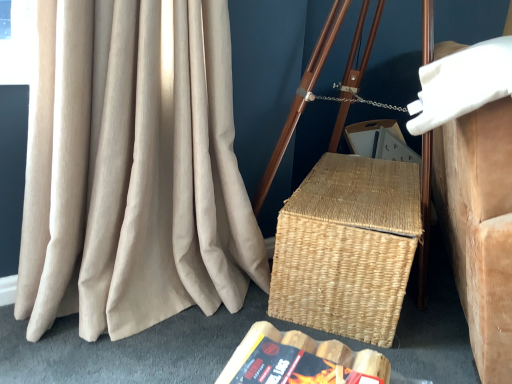
Question: Looking at their shapes, would you say beige corduroy curtain at left is wider or thinner than natural woven picnic basket at center?

Choices:
 (A) thin
 (B) wide

Answer: (A)

Question: Is beige corduroy curtain at left to the left or to the right of natural woven picnic basket at center in the image?

Choices:
 (A) right
 (B) left

Answer: (B)

Question: Which object is positioned closest to the white foam pillow at upper right?

Choices:
 (A) natural woven picnic basket at center
 (B) beige corduroy curtain at left
 (C) hardcover book at lower center

Answer: (A)

Question: Considering the real-world distances, which object is farthest from the white foam pillow at upper right?

Choices:
 (A) beige corduroy curtain at left
 (B) hardcover book at lower center
 (C) natural woven picnic basket at center

Answer: (A)